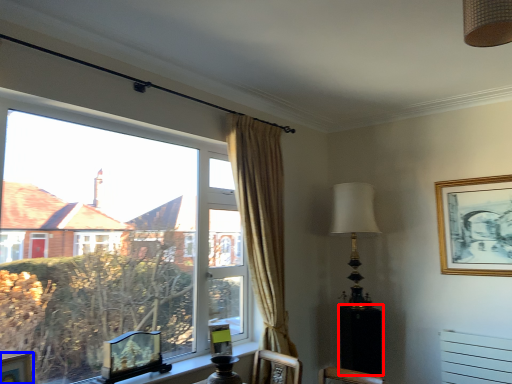
Question: Among these objects, which one is nearest to the camera, side table (highlighted by a red box) or picture frame (highlighted by a blue box)?

Choices:
 (A) side table
 (B) picture frame

Answer: (B)